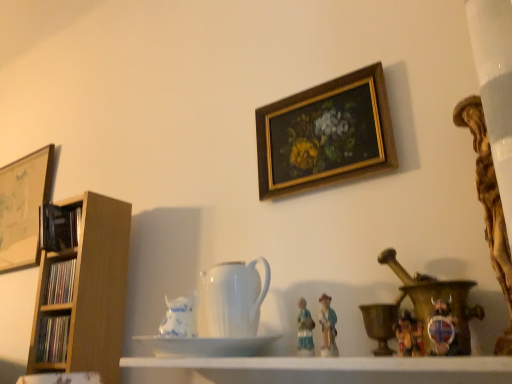
Question: Would you say white glossy saucer at center contains wooden picture frame at left, acting as the 2th picture frame starting from the right?

Choices:
 (A) yes
 (B) no

Answer: (B)

Question: Is white glossy saucer at center outside of wooden picture frame at left, placed as the second picture frame when sorted from front to back?

Choices:
 (A) no
 (B) yes

Answer: (B)

Question: Is white glossy saucer at center oriented towards wooden picture frame at left, the first picture frame in the back-to-front sequence?

Choices:
 (A) no
 (B) yes

Answer: (A)

Question: Is white glossy saucer at center taller than wooden picture frame at left, the 1th picture frame in the left-to-right sequence?

Choices:
 (A) yes
 (B) no

Answer: (B)

Question: Are white glossy saucer at center and wooden picture frame at left, the 1th picture frame in the left-to-right sequence, beside each other?

Choices:
 (A) no
 (B) yes

Answer: (A)

Question: Considering the positions of white glossy saucer at center and blue and white porcelain vase at center in the image, is white glossy saucer at center wider or thinner than blue and white porcelain vase at center?

Choices:
 (A) wide
 (B) thin

Answer: (A)

Question: Visually, is white glossy saucer at center positioned to the left or to the right of blue and white porcelain vase at center?

Choices:
 (A) left
 (B) right

Answer: (B)

Question: From a real-world perspective, is white glossy saucer at center physically located above or below blue and white porcelain vase at center?

Choices:
 (A) below
 (B) above

Answer: (A)

Question: Do you think white glossy saucer at center is within blue and white porcelain vase at center, or outside of it?

Choices:
 (A) inside
 (B) outside

Answer: (B)

Question: In the image, is white glossy shelf at center positioned in front of or behind blue and white porcelain vase at center?

Choices:
 (A) front
 (B) behind

Answer: (A)

Question: From the image's perspective, is white glossy shelf at center above or below blue and white porcelain vase at center?

Choices:
 (A) below
 (B) above

Answer: (A)

Question: Looking at their shapes, would you say white glossy shelf at center is wider or thinner than blue and white porcelain vase at center?

Choices:
 (A) wide
 (B) thin

Answer: (A)

Question: Looking at the image, does white glossy shelf at center seem bigger or smaller compared to blue and white porcelain vase at center?

Choices:
 (A) small
 (B) big

Answer: (B)

Question: Is matte wooden bookshelf at left, the third book in the top-to-bottom sequence, inside the boundaries of gold wooden picture frame at upper center, acting as the 2th picture frame starting from the left, or outside?

Choices:
 (A) inside
 (B) outside

Answer: (B)

Question: Considering the positions of matte wooden bookshelf at left, marked as the 1th book in a bottom-to-top arrangement, and gold wooden picture frame at upper center, the 1th picture frame when ordered from front to back, in the image, is matte wooden bookshelf at left, marked as the 1th book in a bottom-to-top arrangement, wider or thinner than gold wooden picture frame at upper center, the 1th picture frame when ordered from front to back,?

Choices:
 (A) wide
 (B) thin

Answer: (A)